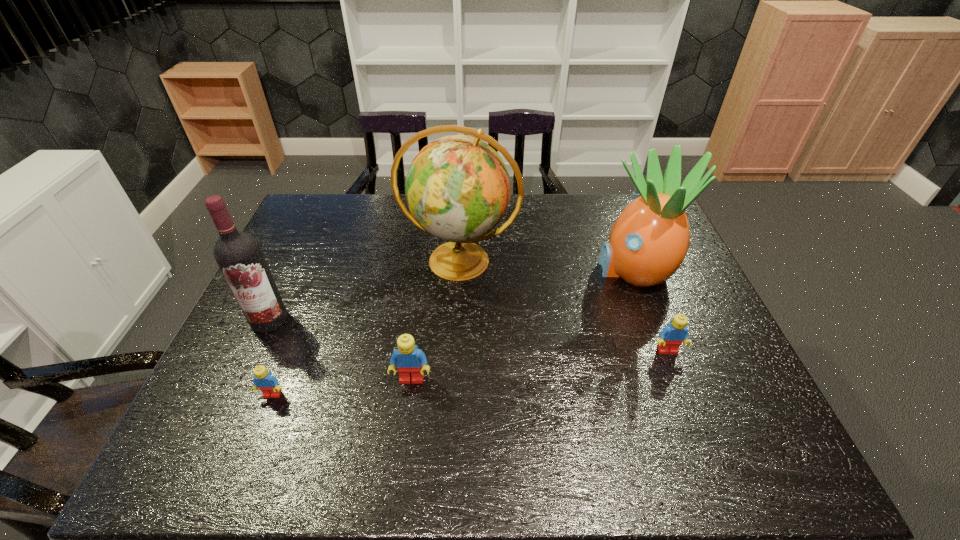
Find the location of a particular element. The image size is (960, 540). free space located on the face of the fourth tallest object is located at coordinates (408, 410).

Identify the location of vacant space positioned 0.130m on the face of the second shortest object. The width and height of the screenshot is (960, 540). (688, 403).

Find the location of a particular element. The image size is (960, 540). free space located on the label of the leftmost object is located at coordinates (247, 369).

At what (x,y) coordinates should I click in order to perform the action: click on free location located 0.230m on the front of the globe. Please return your answer as a coordinate pair (x, y). The image size is (960, 540). Looking at the image, I should click on (454, 359).

I want to click on vacant position located at the entrance of the pineapple, so click(472, 269).

Locate an element on the screen. This screenshot has width=960, height=540. vacant space located at the entrance of the pineapple is located at coordinates (505, 269).

Where is `vacant space located at the entrance of the pineapple`? vacant space located at the entrance of the pineapple is located at coordinates (531, 269).

Locate an element on the screen. object that is at the far edge is located at coordinates (458, 189).

Where is `Lego that is at the left edge`? Image resolution: width=960 pixels, height=540 pixels. Lego that is at the left edge is located at coordinates (266, 382).

Identify the location of wine bottle that is at the left edge. (238, 254).